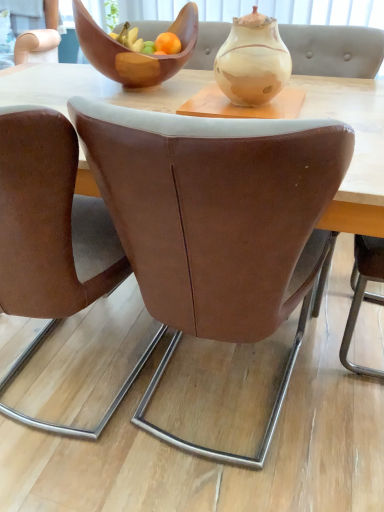
Question: In terms of size, does marbled ceramic vase at center appear bigger or smaller than wooden bowl at upper center?

Choices:
 (A) small
 (B) big

Answer: (A)

Question: From the image's perspective, relative to wooden bowl at upper center, is marbled ceramic vase at center above or below?

Choices:
 (A) above
 (B) below

Answer: (B)

Question: Estimate the real-world distances between objects in this image. Which object is closer to the wooden bowl at upper center?

Choices:
 (A) brown leather chair at center, the 1th chair in the right-to-left sequence
 (B) brown leather chair at left, the first chair viewed from the left
 (C) marbled ceramic vase at center

Answer: (C)

Question: Which object is positioned farthest from the brown leather chair at left, acting as the 2th chair starting from the right?

Choices:
 (A) marbled ceramic vase at center
 (B) brown leather chair at center, the 1th chair in the right-to-left sequence
 (C) wooden bowl at upper center

Answer: (C)